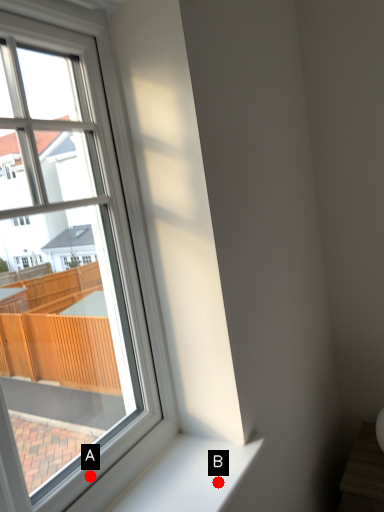
Question: Two points are circled on the image, labeled by A and B beside each circle. Which point is farther from the camera taking this photo?

Choices:
 (A) A is further
 (B) B is further

Answer: (B)